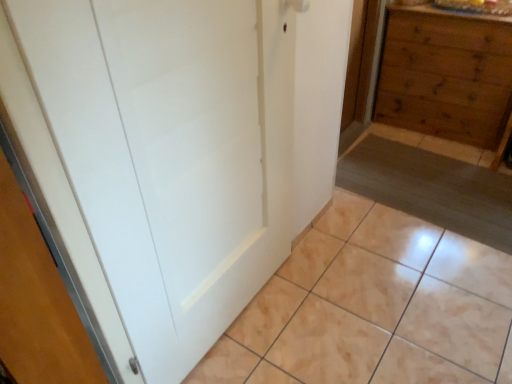
Question: From a real-world perspective, is beige glossy tile at lower center physically above wooden chest of drawers at right?

Choices:
 (A) yes
 (B) no

Answer: (B)

Question: Is beige glossy tile at lower center positioned before wooden chest of drawers at right?

Choices:
 (A) yes
 (B) no

Answer: (A)

Question: Would you say beige glossy tile at lower center is a long distance from wooden chest of drawers at right?

Choices:
 (A) no
 (B) yes

Answer: (B)

Question: Is beige glossy tile at lower center at the left side of wooden chest of drawers at right?

Choices:
 (A) yes
 (B) no

Answer: (A)

Question: Considering the relative sizes of beige glossy tile at lower center and wooden chest of drawers at right in the image provided, is beige glossy tile at lower center bigger than wooden chest of drawers at right?

Choices:
 (A) no
 (B) yes

Answer: (A)

Question: Considering their positions, is beige glossy tile at lower center located in front of or behind white matte door at center?

Choices:
 (A) front
 (B) behind

Answer: (B)

Question: Based on their positions, is beige glossy tile at lower center located to the left or right of white matte door at center?

Choices:
 (A) left
 (B) right

Answer: (B)

Question: Is beige glossy tile at lower center inside the boundaries of white matte door at center, or outside?

Choices:
 (A) inside
 (B) outside

Answer: (B)

Question: From the image's perspective, is beige glossy tile at lower center above or below white matte door at center?

Choices:
 (A) above
 (B) below

Answer: (B)

Question: From a real-world perspective, is wooden chest of drawers at right above or below beige glossy tile at lower center?

Choices:
 (A) below
 (B) above

Answer: (B)

Question: Would you say wooden chest of drawers at right is inside or outside beige glossy tile at lower center?

Choices:
 (A) inside
 (B) outside

Answer: (B)

Question: Considering the positions of wooden chest of drawers at right and beige glossy tile at lower center in the image, is wooden chest of drawers at right taller or shorter than beige glossy tile at lower center?

Choices:
 (A) tall
 (B) short

Answer: (A)

Question: Considering the positions of wooden chest of drawers at right and beige glossy tile at lower center in the image, is wooden chest of drawers at right bigger or smaller than beige glossy tile at lower center?

Choices:
 (A) small
 (B) big

Answer: (B)

Question: Does point (292, 105) appear closer or farther from the camera than point (258, 306)?

Choices:
 (A) farther
 (B) closer

Answer: (B)

Question: Is white matte door at center inside the boundaries of beige glossy tile at lower center, or outside?

Choices:
 (A) outside
 (B) inside

Answer: (A)